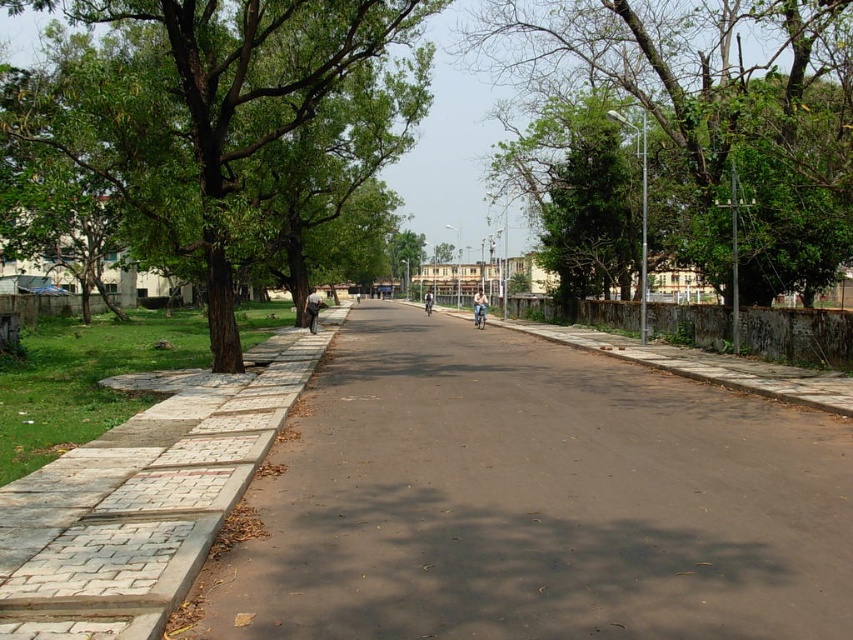
You are a pedestrian standing on the sidewalk and want to cross the street to reach a bench on the opposite side. The paved asphalt road at left and the green leafy tree at left are in your line of sight. Which object should you look out for to ensure you cross safely?

You should look out for the paved asphalt road at left because it is to the right of the green leafy tree at left, meaning the road is closer to your path when crossing the street.

You are a pedestrian standing on the sidewalk on the left side of the road. You see a green leafy tree at upper right and a light blue fabric jacket at center. Which object is bigger in size?

The green leafy tree at upper right is larger in size than the light blue fabric jacket at center.